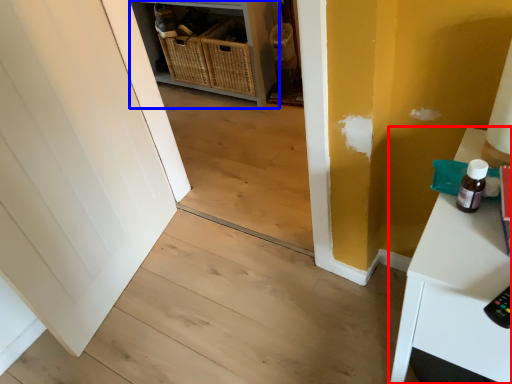
Question: Among these objects, which one is farthest to the camera, table (highlighted by a red box) or shelf (highlighted by a blue box)?

Choices:
 (A) table
 (B) shelf

Answer: (B)